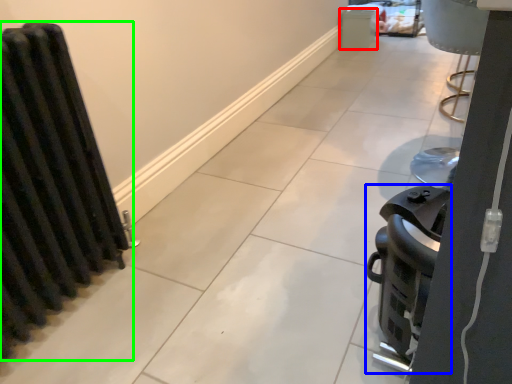
Question: Which object is positioned closest to appliance (highlighted by a red box)? Select from appliance (highlighted by a blue box) and radiator (highlighted by a green box).

Choices:
 (A) appliance
 (B) radiator

Answer: (A)